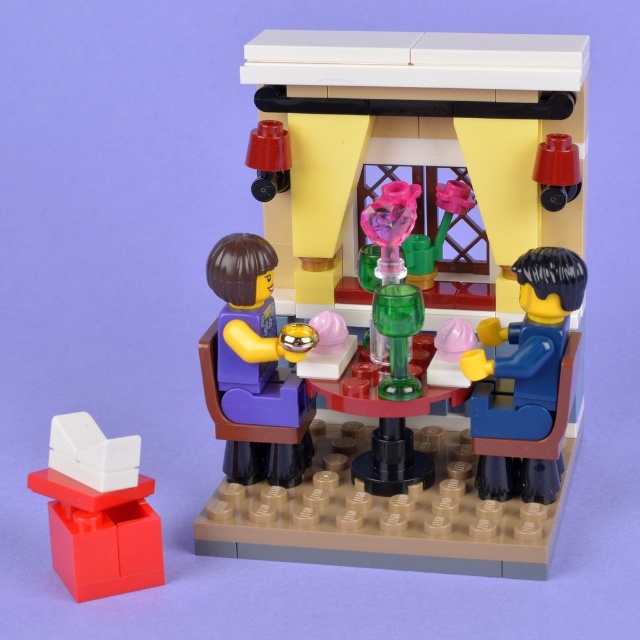
Question: Estimate the real-world distances between objects in this image. Which object is closer to the purple matte/vinyl figure at center?

Choices:
 (A) blue matte figure at right
 (B) white plastic chair at lower left
 (C) matte green vase at center

Answer: (C)

Question: Is purple matte/vinyl figure at center positioned in front of blue matte figure at right?

Choices:
 (A) no
 (B) yes

Answer: (A)

Question: From the image, what is the correct spatial relationship of purple matte/vinyl figure at center in relation to white plastic chair at lower left?

Choices:
 (A) left
 (B) right

Answer: (B)

Question: Which object appears closest to the camera in this image?

Choices:
 (A) white plastic chair at lower left
 (B) matte green vase at center
 (C) purple matte/vinyl figure at center

Answer: (A)

Question: Is blue matte figure at right thinner than white plastic chair at lower left?

Choices:
 (A) yes
 (B) no

Answer: (A)

Question: Which object is positioned farthest from the white plastic chair at lower left?

Choices:
 (A) blue matte figure at right
 (B) purple matte/vinyl figure at center

Answer: (A)